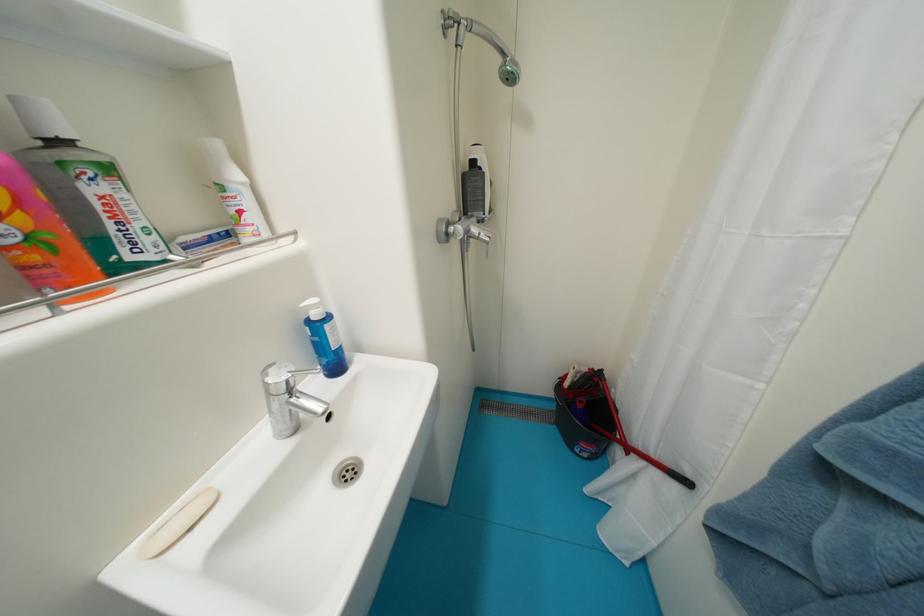
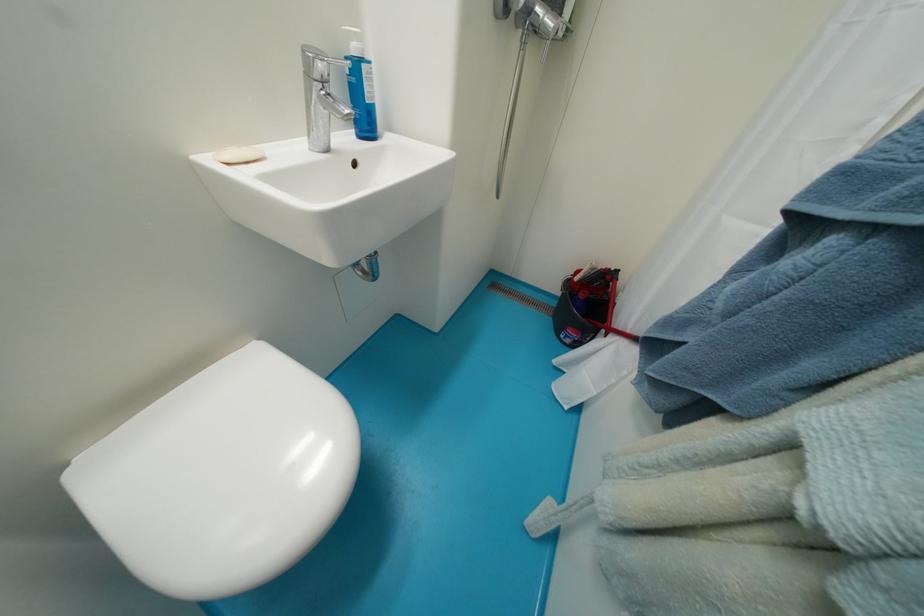
Locate, in the second image, the point that corresponds to point (275, 395) in the first image.

(313, 78)